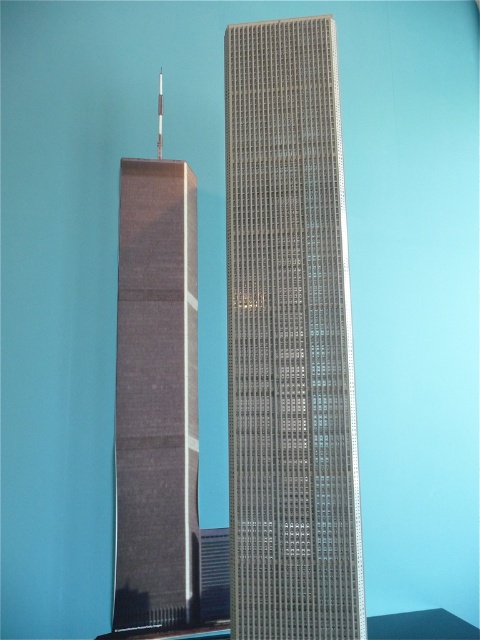
Question: Which object is closer to the camera taking this photo?

Choices:
 (A) sleek glass skyscraper at center
 (B) matte gray tower at left

Answer: (A)

Question: Among these points, which one is farthest from the camera?

Choices:
 (A) (118, 276)
 (B) (307, 624)

Answer: (A)

Question: Is sleek glass skyscraper at center further to camera compared to matte gray tower at left?

Choices:
 (A) yes
 (B) no

Answer: (B)

Question: Observing the image, what is the correct spatial positioning of sleek glass skyscraper at center in reference to matte gray tower at left?

Choices:
 (A) right
 (B) left

Answer: (A)

Question: Is sleek glass skyscraper at center above matte gray tower at left?

Choices:
 (A) yes
 (B) no

Answer: (A)